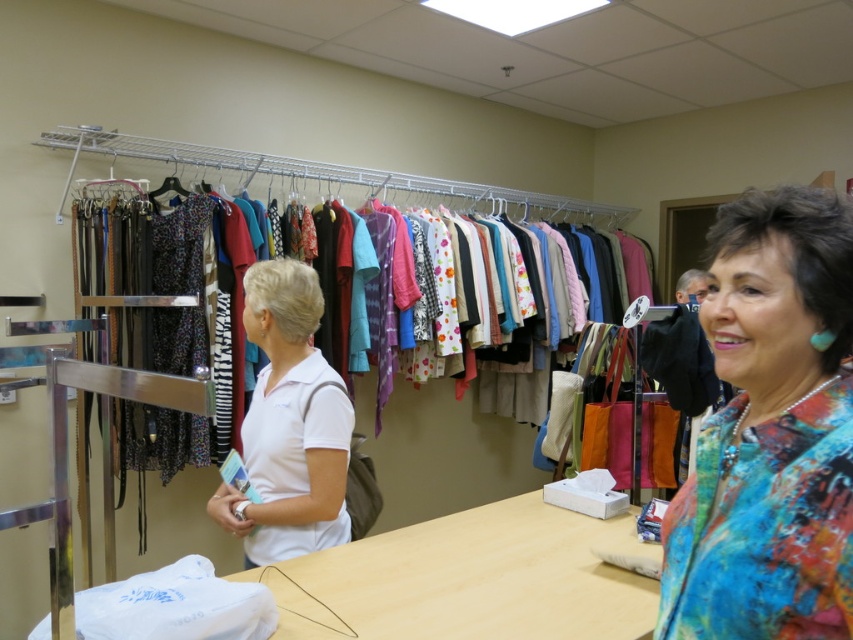
Question: Does textured multicolored jacket at center have a lesser width compared to wooden table at center?

Choices:
 (A) no
 (B) yes

Answer: (B)

Question: Which point is closer to the camera?

Choices:
 (A) matte fabric clothes at center
 (B) wooden table at center

Answer: (B)

Question: Observing the image, what is the correct spatial positioning of wooden table at center in reference to matte fabric clothes at center?

Choices:
 (A) left
 (B) right

Answer: (B)

Question: Which of the following is the closest to the observer?

Choices:
 (A) (164, 186)
 (B) (599, 618)
 (C) (790, 205)

Answer: (C)

Question: Which point appears farthest from the camera in this image?

Choices:
 (A) (515, 509)
 (B) (77, 284)
 (C) (795, 429)

Answer: (B)

Question: Does wooden table at center appear on the right side of white matte polo shirt at center?

Choices:
 (A) yes
 (B) no

Answer: (A)